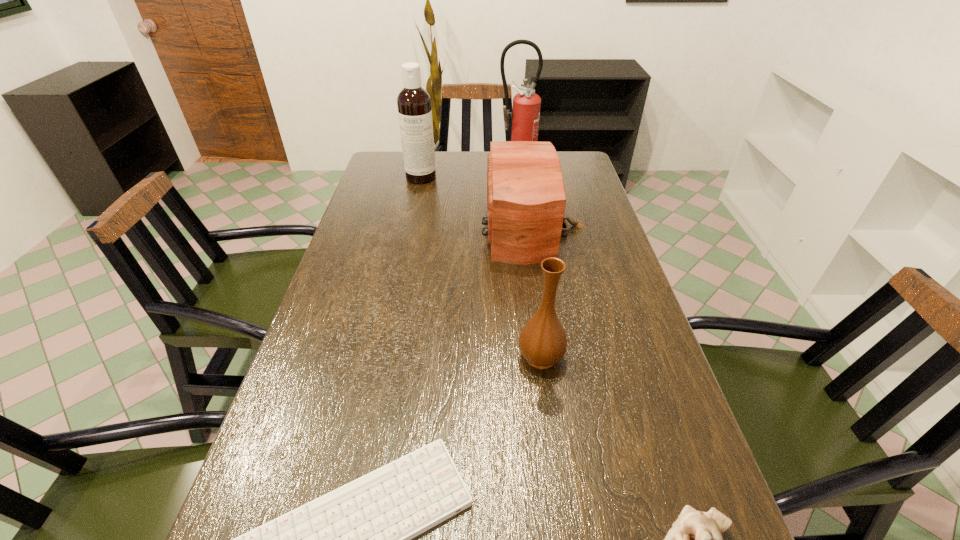
Find the location of a particular element. The image size is (960, 540). free space between the fire extinguisher and the fifth nearest object is located at coordinates (468, 167).

Where is `vacant area that lies between the fourth nearest object and the fourth farthest object`? The height and width of the screenshot is (540, 960). vacant area that lies between the fourth nearest object and the fourth farthest object is located at coordinates (537, 291).

I want to click on vacant area that lies between the dishwasher detergent and the radio receiver, so click(476, 201).

Find the location of a particular element. The width and height of the screenshot is (960, 540). object identified as the second closest to the fourth nearest object is located at coordinates (525, 116).

Locate which object ranks second in proximity to the vase. Please provide its 2D coordinates. Your answer should be formatted as a tuple, i.e. [(x, y)], where the tuple contains the x and y coordinates of a point satisfying the conditions above.

[(695, 539)]

Identify the location of vacant space that satisfies the following two spatial constraints: 1. on the label side of the fifth nearest object; 2. on the right side of the fourth farthest object. The width and height of the screenshot is (960, 540). (384, 356).